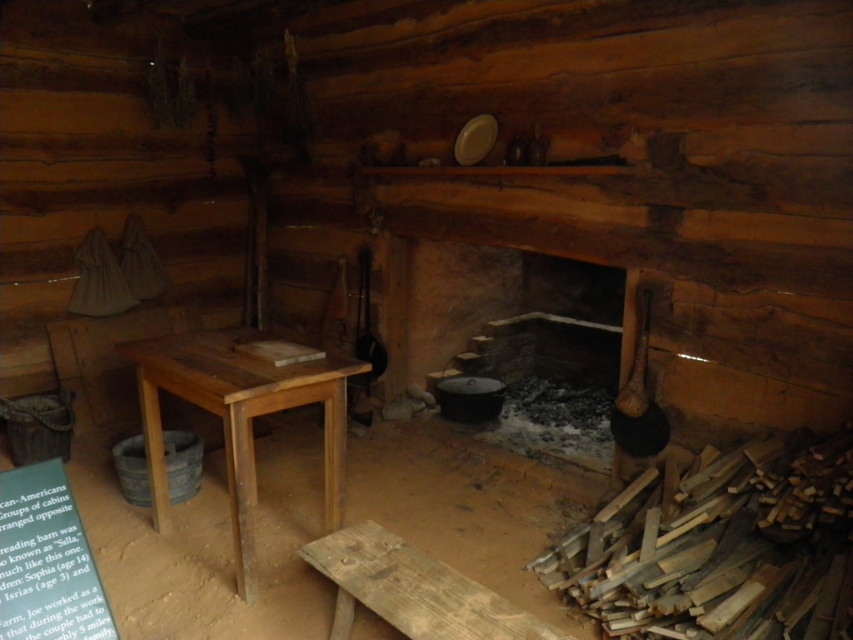
Does wooden table at center appear over weathered wooden bench at lower center?

Yes, wooden table at center is above weathered wooden bench at lower center.

Which is above, wooden table at center or weathered wooden bench at lower center?

wooden table at center is above.

Is point (247, 492) positioned before point (508, 605)?

No, it is behind (508, 605).

Find the location of `wooden table at center`. wooden table at center is located at coordinates (241, 417).

Is dark brown stone fireplace at center to the right of wooden table at center from the viewer's perspective?

Indeed, dark brown stone fireplace at center is positioned on the right side of wooden table at center.

Who is higher up, dark brown stone fireplace at center or wooden table at center?

dark brown stone fireplace at center

Locate an element on the screen. dark brown stone fireplace at center is located at coordinates (495, 307).

Does dark brown stone fireplace at center have a greater width compared to weathered wooden bench at lower center?

Yes.

The image size is (853, 640). What are the coordinates of `dark brown stone fireplace at center` in the screenshot? It's located at (495, 307).

Find the location of a particular element. dark brown stone fireplace at center is located at coordinates (495, 307).